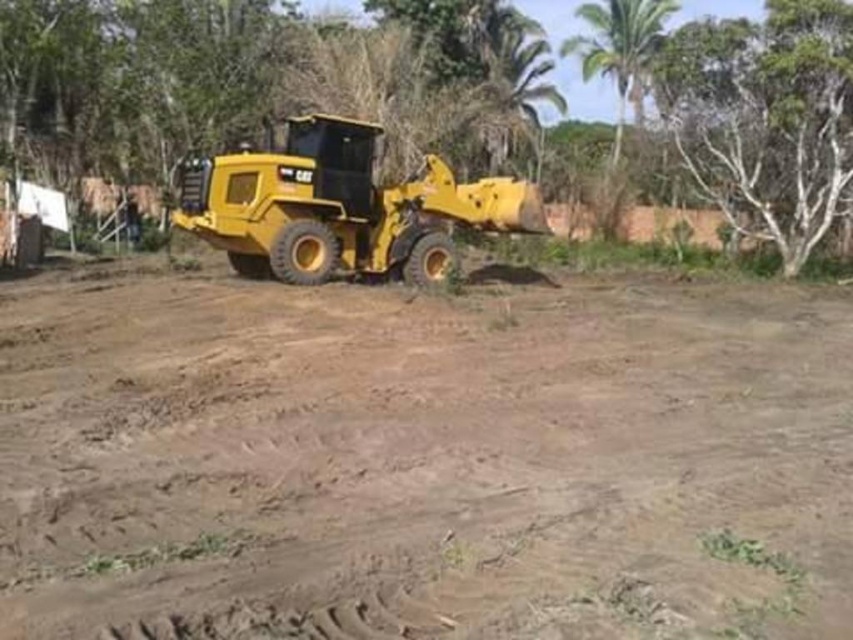
Does brown sandy dirt at center appear over green leafy tree at upper center?

No, brown sandy dirt at center is not above green leafy tree at upper center.

Is brown sandy dirt at center shorter than green leafy tree at upper center?

Yes.

At what (x,y) coordinates should I click in order to perform the action: click on brown sandy dirt at center. Please return your answer as a coordinate pair (x, y). The height and width of the screenshot is (640, 853). Looking at the image, I should click on (421, 452).

The height and width of the screenshot is (640, 853). I want to click on brown sandy dirt at center, so click(421, 452).

Is point (103, 298) positioned before point (329, 234)?

Yes, it is in front of point (329, 234).

You are a GUI agent. You are given a task and a screenshot of the screen. Output one action in this format:
    pyautogui.click(x=<x>, y=<y>)
    Task: Click on the brown sandy dirt at center
    
    Given the screenshot: What is the action you would take?
    pyautogui.click(x=421, y=452)

The width and height of the screenshot is (853, 640). Find the location of `brown sandy dirt at center`. brown sandy dirt at center is located at coordinates (421, 452).

Does point (294, 328) lie in front of point (724, 42)?

Yes, point (294, 328) is in front of point (724, 42).

Who is shorter, brown sandy dirt at center or white smooth tree at upper right?

brown sandy dirt at center

Which is in front, point (32, 557) or point (682, 64)?

Point (32, 557)

This screenshot has height=640, width=853. I want to click on brown sandy dirt at center, so click(x=421, y=452).